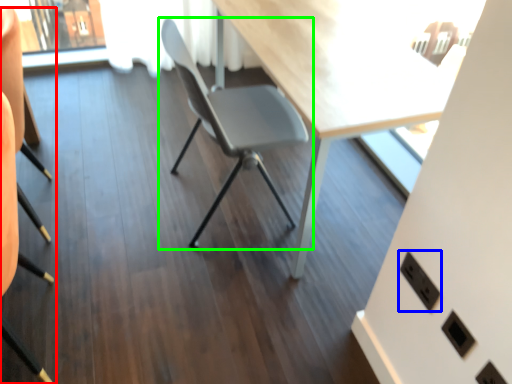
Question: Estimate the real-world distances between objects in this image. Which object is closer to chair (highlighted by a red box), electric outlet (highlighted by a blue box) or chair (highlighted by a green box)?

Choices:
 (A) electric outlet
 (B) chair

Answer: (B)